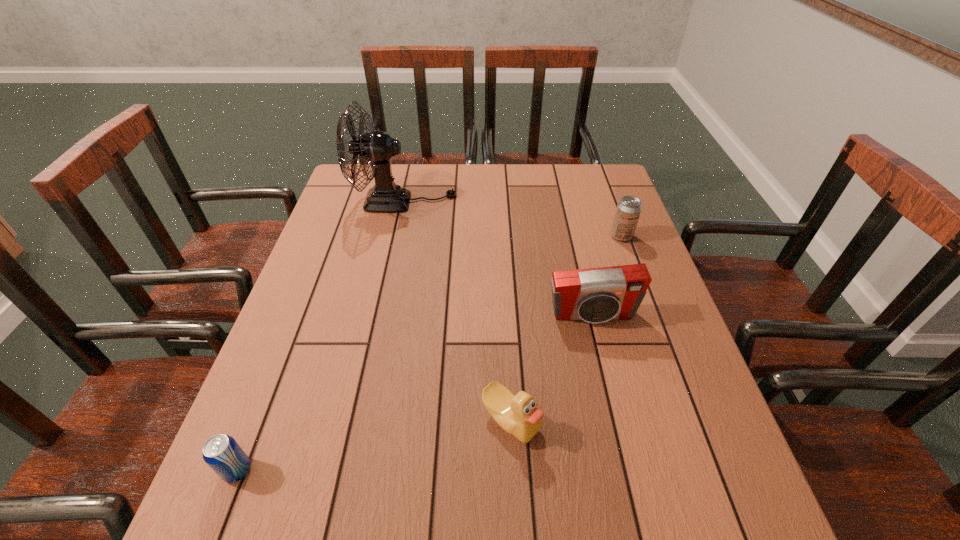
The height and width of the screenshot is (540, 960). I want to click on free region that satisfies the following two spatial constraints: 1. in front of the tallest object, indicating the direction of air flow; 2. on the left side of the farther beer can, so click(396, 236).

Locate an element on the screen. The height and width of the screenshot is (540, 960). blank area in the image that satisfies the following two spatial constraints: 1. in front of the farthest object, indicating the direction of air flow; 2. on the left side of the taller beer can is located at coordinates (396, 236).